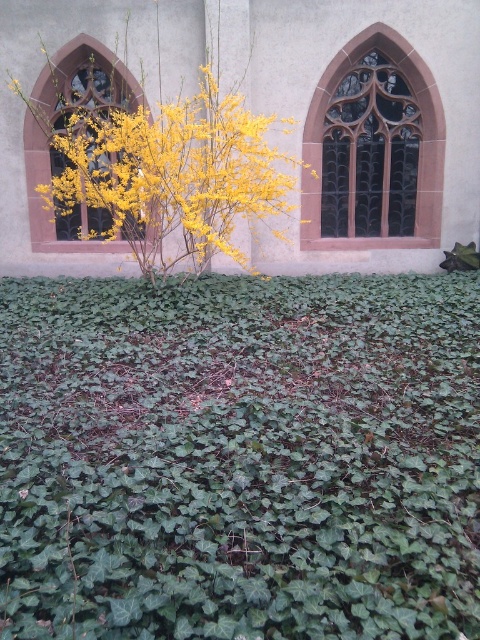
Is green leafy ivy at center to the left of matte glass window at center from the viewer's perspective?

No, green leafy ivy at center is not to the left of matte glass window at center.

Is green leafy ivy at center smaller than matte glass window at center?

No, green leafy ivy at center is not smaller than matte glass window at center.

Who is more distant from viewer, (312, 369) or (27, 145)?

Point (27, 145)

This screenshot has height=640, width=480. I want to click on green leafy ivy at center, so click(240, 458).

In order to click on matte glass window at center in this screenshot , I will do `click(63, 128)`.

Which is more to the left, matte glass window at center or dark glass window at upper center?

From the viewer's perspective, matte glass window at center appears more on the left side.

Which is behind, point (120, 250) or point (415, 80)?

The point (120, 250) is more distant.

You are a GUI agent. You are given a task and a screenshot of the screen. Output one action in this format:
    pyautogui.click(x=<x>, y=<y>)
    Task: Click on the matte glass window at center
    Image resolution: width=480 pixels, height=640 pixels.
    Given the screenshot: What is the action you would take?
    pyautogui.click(x=63, y=128)

Is green leafy ivy at center to the right of yellow matte flower at center from the viewer's perspective?

Indeed, green leafy ivy at center is positioned on the right side of yellow matte flower at center.

Between point (278, 394) and point (151, 204), which one is positioned in front?

Point (278, 394) is more forward.

Locate an element on the screen. green leafy ivy at center is located at coordinates (240, 458).